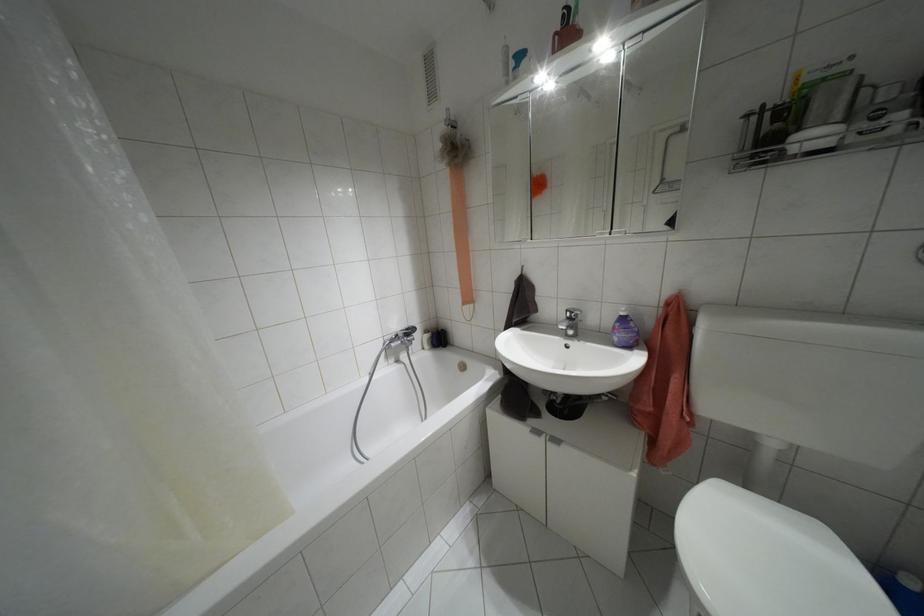
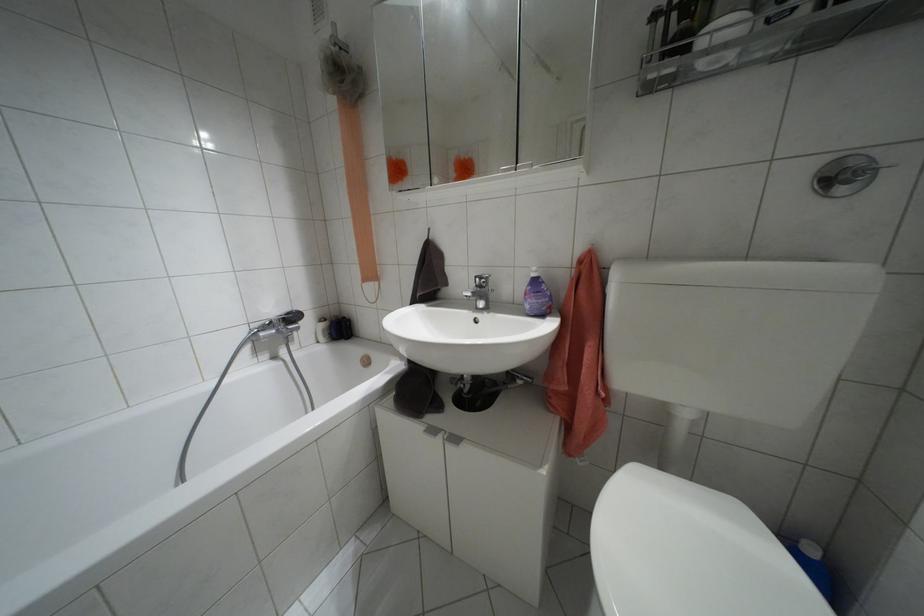
Locate, in the second image, the point that corresponds to the point at 622,313 in the first image.

(532, 274)